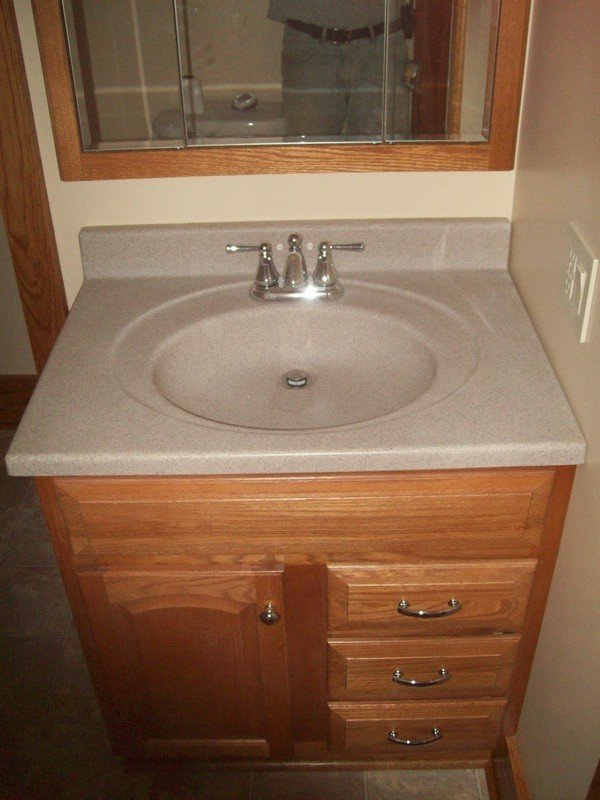
In order to click on floor in this screenshot , I will do `click(411, 782)`.